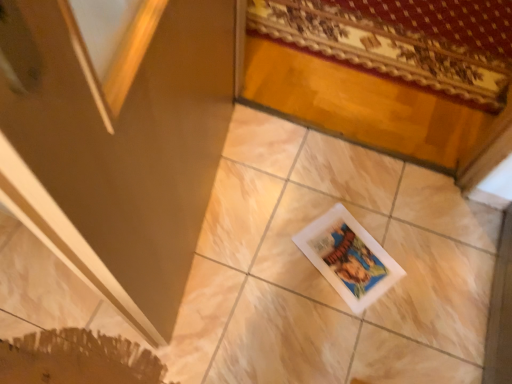
I want to click on free region under patterned fabric mat at upper right (from a real-world perspective), so pyautogui.click(x=388, y=35).